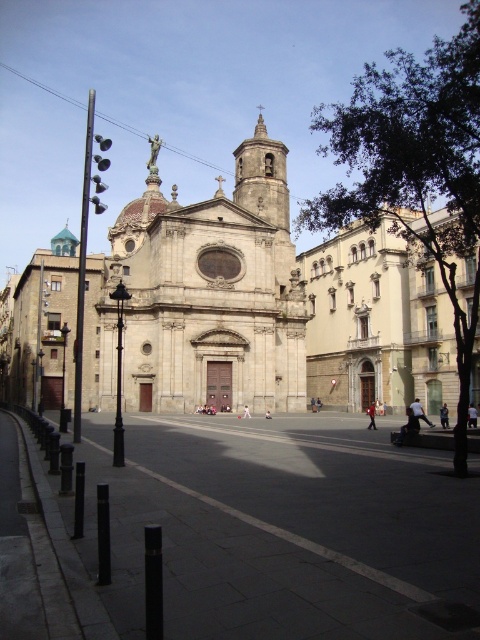
You are standing in front of the gray stone church at center and want to walk to the dark concrete plaza at center. Which direction should you move relative to the church?

You should move to the right relative to the gray stone church at center because the dark concrete plaza at center is located to its right.

You are planning to host an outdoor event and need to set up a stage. You have two options for locations based on the image provided. The first option is the dark concrete plaza at center, and the second is the gray stone church at center. Which location has a wider area to accommodate more attendees?

The gray stone church at center has a greater width than the dark concrete plaza at center, so it would provide a wider area for accommodating more attendees.

You are standing in front of the church and want to walk towards the smooth stone bell tower at center. Which direction should you head relative to the dark concrete plaza at center?

You should head to the left of the dark concrete plaza at center because the dark concrete plaza at center is on the right side of the smooth stone bell tower at center, so moving left would bring you closer to the bell tower.